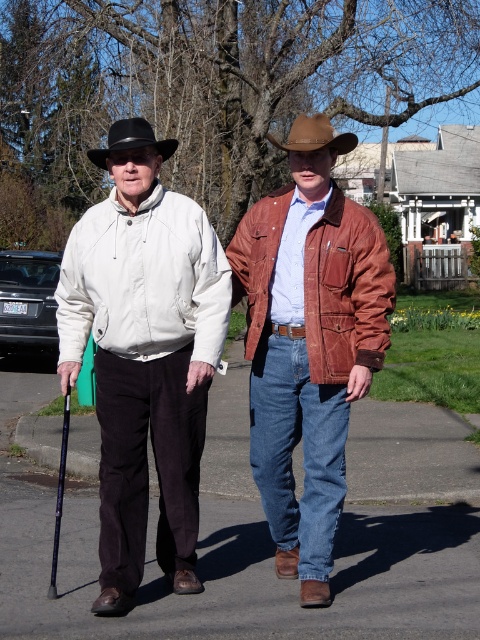
You are a photographer trying to capture the suede brown jacket at center in your shot. Based on its 2D coordinates, where should you position your camera to ensure it is centered in the frame?

The suede brown jacket at center is located at coordinates 0.550 on the x axis and 0.644 on the y axis. To center it in the frame, position your camera so that the crosshairs align with these coordinates.